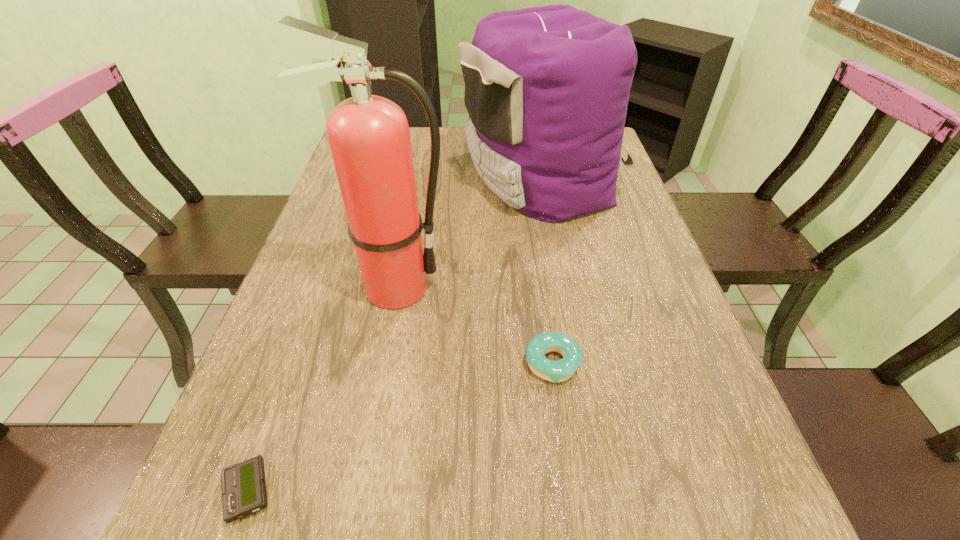
Where is `the second farthest object`? The width and height of the screenshot is (960, 540). the second farthest object is located at coordinates (369, 138).

This screenshot has width=960, height=540. What are the coordinates of `the tallest object` in the screenshot? It's located at (369, 138).

Locate an element on the screen. The width and height of the screenshot is (960, 540). the second tallest object is located at coordinates (547, 88).

This screenshot has width=960, height=540. Identify the location of backpack. (547, 88).

What are the coordinates of `the third tallest object` in the screenshot? It's located at (561, 370).

Locate an element on the screen. The height and width of the screenshot is (540, 960). doughnut is located at coordinates (561, 370).

You are a GUI agent. You are given a task and a screenshot of the screen. Output one action in this format:
    pyautogui.click(x=<x>, y=<y>)
    Task: Click on the beeper
    This screenshot has height=540, width=960.
    Given the screenshot: What is the action you would take?
    pyautogui.click(x=244, y=492)

You are a GUI agent. You are given a task and a screenshot of the screen. Output one action in this format:
    pyautogui.click(x=<x>, y=<y>)
    Task: Click on the nearest object
    This screenshot has width=960, height=540.
    Given the screenshot: What is the action you would take?
    pyautogui.click(x=244, y=492)

Identify the location of free spot located on the hose direction of the tallest object. The height and width of the screenshot is (540, 960). (598, 288).

The width and height of the screenshot is (960, 540). I want to click on vacant space located on the front pocket of the backpack, so click(423, 177).